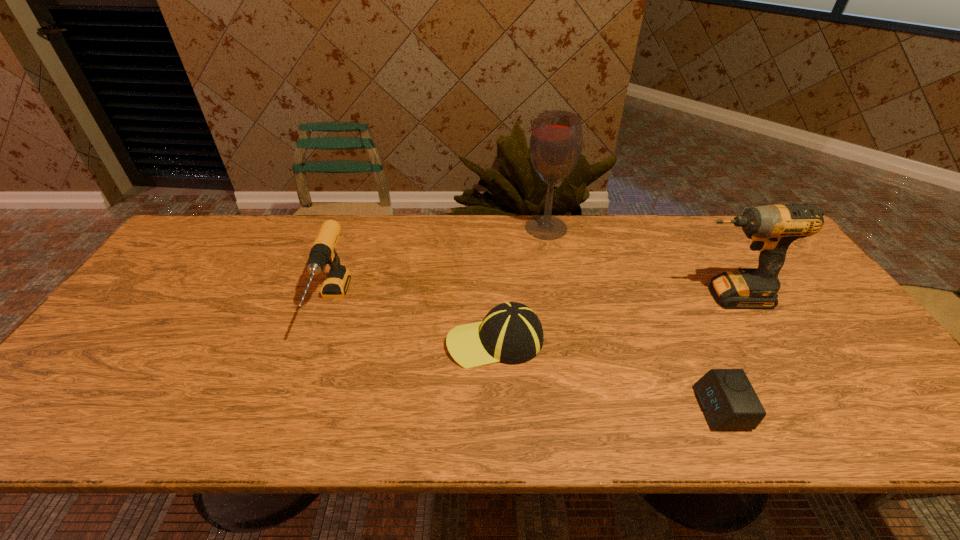
At what (x,y) coordinates should I click in order to perform the action: click on vacant area in the image that satisfies the following two spatial constraints: 1. with the drill bit of the taller drill facing forward; 2. on the handle side of the left drill. Please return your answer as a coordinate pair (x, y). Looking at the image, I should click on (732, 304).